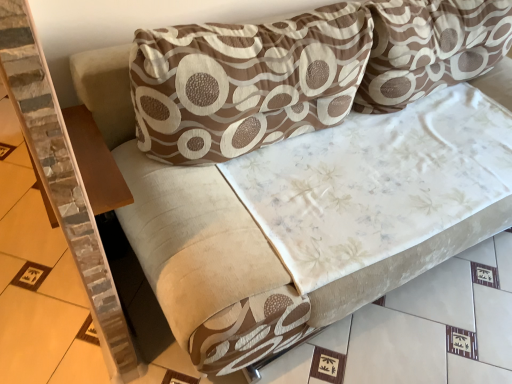
Question: Would you say brown wood table at left is a long distance from brown printed fabric pillow at upper center, the first pillow viewed from the right?

Choices:
 (A) no
 (B) yes

Answer: (B)

Question: Could you tell me if brown wood table at left is facing brown printed fabric pillow at upper center, positioned as the second pillow in left-to-right order?

Choices:
 (A) no
 (B) yes

Answer: (B)

Question: Does brown wood table at left lie behind brown printed fabric pillow at upper center, the first pillow viewed from the right?

Choices:
 (A) no
 (B) yes

Answer: (A)

Question: From the image's perspective, is brown wood table at left beneath brown printed fabric pillow at upper center, positioned as the second pillow in left-to-right order?

Choices:
 (A) no
 (B) yes

Answer: (B)

Question: Is brown wood table at left with brown printed fabric pillow at upper center, the first pillow viewed from the right?

Choices:
 (A) no
 (B) yes

Answer: (A)

Question: From the image's perspective, is brown printed fabric pillow at upper center, positioned as the second pillow in left-to-right order, located above or below brown printed cushion at upper center, arranged as the 2th pillow when viewed from the right?

Choices:
 (A) below
 (B) above

Answer: (B)

Question: From a real-world perspective, is brown printed fabric pillow at upper center, the first pillow viewed from the right, physically located above or below brown printed cushion at upper center, arranged as the 2th pillow when viewed from the right?

Choices:
 (A) above
 (B) below

Answer: (A)

Question: Does point (403, 82) appear closer or farther from the camera than point (239, 89)?

Choices:
 (A) farther
 (B) closer

Answer: (A)

Question: Is brown printed fabric pillow at upper center, the first pillow viewed from the right, situated inside brown printed cushion at upper center, positioned as the 1th pillow in left-to-right order, or outside?

Choices:
 (A) outside
 (B) inside

Answer: (A)

Question: Is brown printed cushion at upper center, positioned as the 1th pillow in left-to-right order, to the left or to the right of brown printed fabric pillow at upper center, positioned as the second pillow in left-to-right order, in the image?

Choices:
 (A) left
 (B) right

Answer: (A)

Question: Is brown printed cushion at upper center, arranged as the 2th pillow when viewed from the right, wider or thinner than brown printed fabric pillow at upper center, the first pillow viewed from the right?

Choices:
 (A) wide
 (B) thin

Answer: (B)

Question: Is point (347, 89) positioned closer to the camera than point (412, 79)?

Choices:
 (A) closer
 (B) farther

Answer: (A)

Question: From the image's perspective, is brown printed cushion at upper center, arranged as the 2th pillow when viewed from the right, positioned above or below brown printed fabric pillow at upper center, positioned as the second pillow in left-to-right order?

Choices:
 (A) above
 (B) below

Answer: (B)

Question: Is brown printed cushion at upper center, positioned as the 1th pillow in left-to-right order, bigger or smaller than brown wood table at left?

Choices:
 (A) big
 (B) small

Answer: (A)

Question: Does point (178, 163) appear closer or farther from the camera than point (87, 178)?

Choices:
 (A) farther
 (B) closer

Answer: (A)